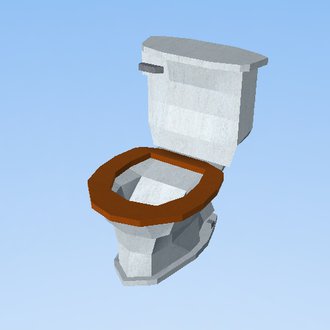
Locate an element on the screen. The width and height of the screenshot is (330, 330). toilet seat is located at coordinates (182, 204).